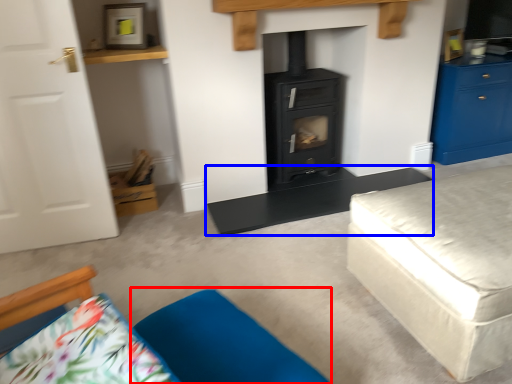
Question: Which of the following is the closest to the observer, pillow (highlighted by a red box) or table (highlighted by a blue box)?

Choices:
 (A) pillow
 (B) table

Answer: (A)